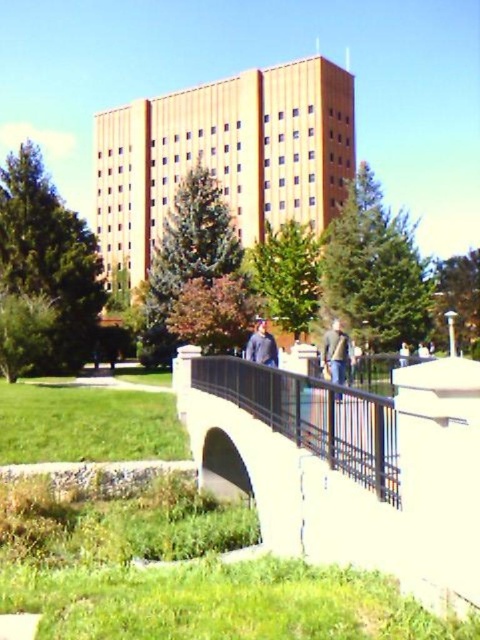
Question: Does black metal rail at center have a greater width compared to denim jacket at right?

Choices:
 (A) no
 (B) yes

Answer: (A)

Question: Which point is farther from the camera taking this photo?

Choices:
 (A) (387, 556)
 (B) (326, 371)
 (C) (272, 428)
 (D) (265, 356)

Answer: (B)

Question: Does black metal rail at center lie in front of denim jacket at right?

Choices:
 (A) yes
 (B) no

Answer: (A)

Question: Can you confirm if white concrete pedestrian bridge at center is thinner than black metal rail at center?

Choices:
 (A) yes
 (B) no

Answer: (B)

Question: Which object appears closest to the camera in this image?

Choices:
 (A) denim jacket at center
 (B) denim jacket at right

Answer: (B)

Question: Which point is farther from the camera taking this photo?

Choices:
 (A) (348, 404)
 (B) (324, 362)
 (C) (433, 560)

Answer: (B)